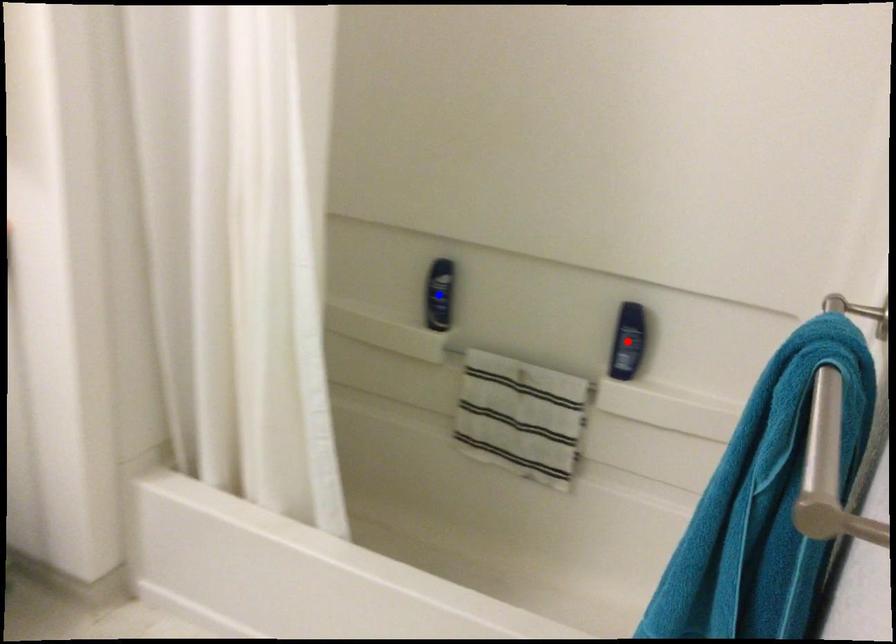
Question: Two points are marked on the image. Which point is closer to the camera?

Choices:
 (A) Blue point is closer.
 (B) Red point is closer.

Answer: (B)